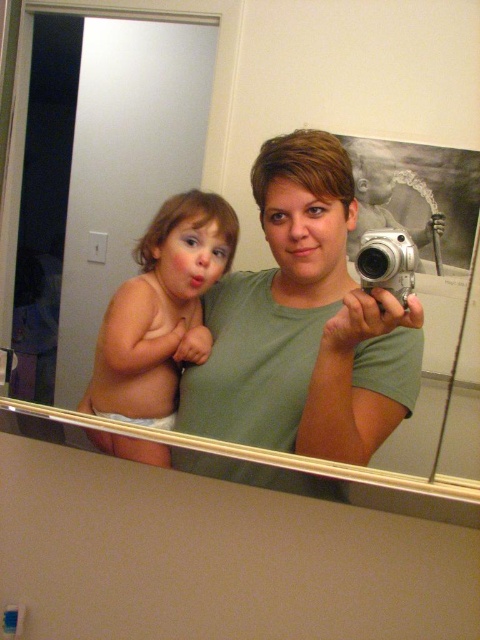
You are a photographer trying to capture a candid shot of the smooth skin baby at left and the silver metallic camera at center. Since you can only focus on one subject, which one is closer to the camera in the mirror selfie?

The smooth skin baby at left is positioned on the left side of silver metallic camera at center, so the baby is closer to the camera in the mirror selfie.

You are trying to decide which object to grab first in the mirror selfie scene. The matte green shirt at center and the silver metallic camera at center are both in your view. Which object is bigger?

The matte green shirt at center is larger than the silver metallic camera at center.

You are trying to decide whether to place a small decorative item on the matte green shirt at center or the silver metallic camera at center. Which object has enough vertical space to support a tall item?

The matte green shirt at center is much taller than the silver metallic camera at center, so it has more vertical space to support a tall item.